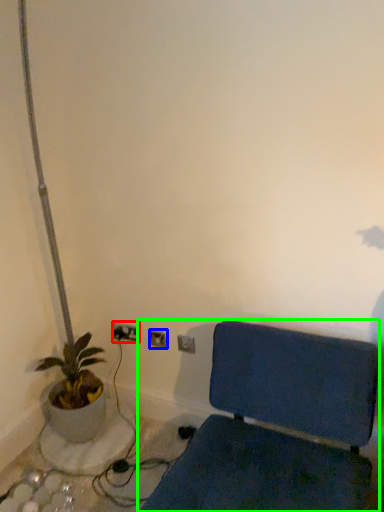
Question: Considering the real-world distances, which object is closest to electric outlet (highlighted by a red box)? electric outlet (highlighted by a blue box) or furniture (highlighted by a green box).

Choices:
 (A) electric outlet
 (B) furniture

Answer: (A)